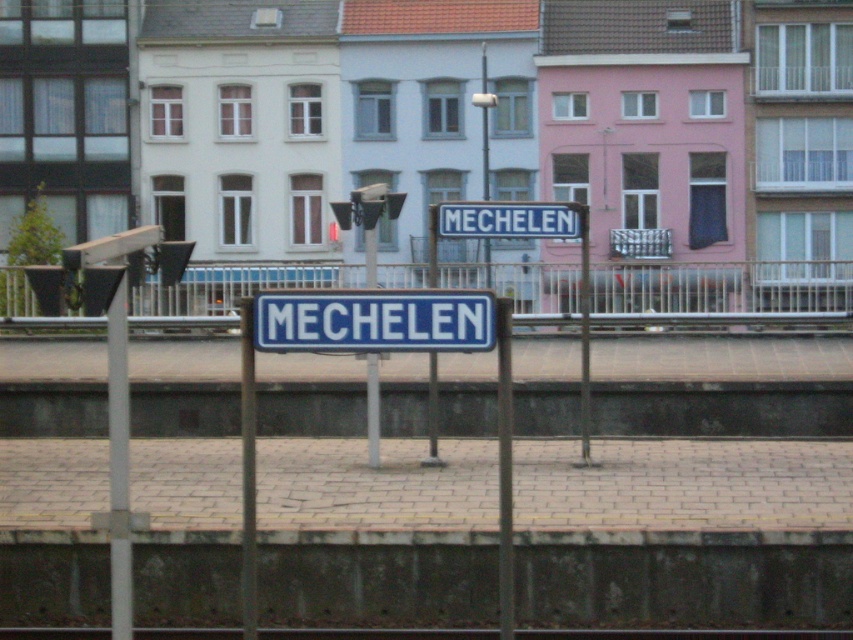
Consider the image. You are standing on the platform and want to walk towards the blue metallic sign at center. Which direction should you move relative to the metallic gray train track at center?

You should move to the right relative to the metallic gray train track at center because the metallic gray train track at center is to the left of the blue metallic sign at center, so the sign is on the right side of the track.

You are standing on the platform and want to walk towards the blue metallic sign at center. Which direction should you move relative to the blue metal rail at center?

You should move to the right relative to the blue metal rail at center because the blue metal rail at center is to the left of the blue metallic sign at center.

You are standing on the train station platform and want to find the blue metal rail at center. According to the image, where is the point located at coordinate [722,292]?

The point at coordinate [722,292] is located on the blue metal rail at center.